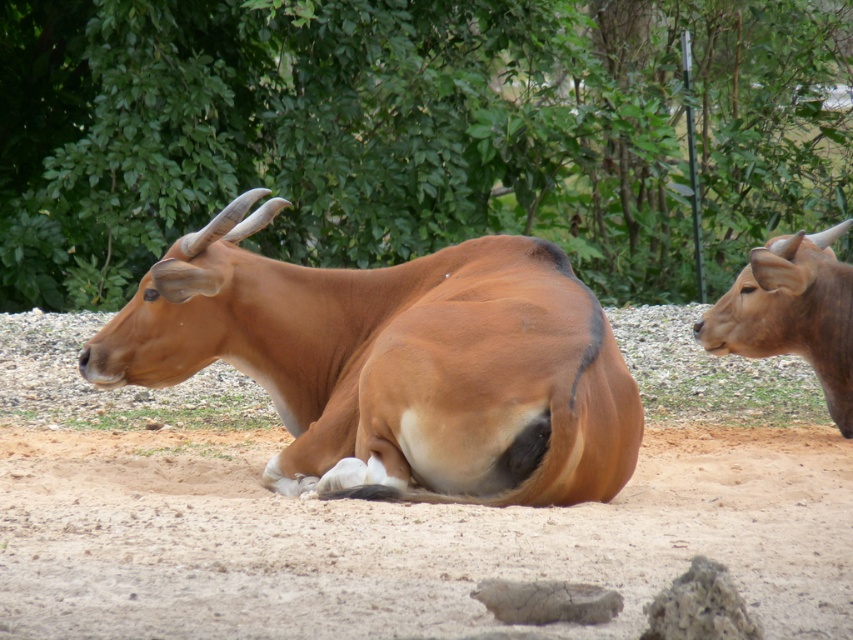
You are a zookeeper observing the Banteng lying on the left side of the frame. You notice a point in the image at coordinates [415,132]. What object is located at this point?

The point at [415,132] has a green leafy tree at upper center.

You are a zookeeper who needs to place a new feeding station between the green leafy tree at upper center and the brown matte bull at right. Based on their positions, which side of the feeding station should be closer to the tree?

The green leafy tree at upper center is to the left of the brown matte bull at right, so the feeding station should be placed with its left side closer to the tree.

You are a zookeeper who needs to place a feeding station for the Banteng. The feeding station must be placed in an area that is not directly under the green leafy tree at upper center. Where should you position it?

The green leafy tree at upper center is located at point (x=415, y=132), so the feeding station should be placed away from that coordinate to avoid being directly under it.